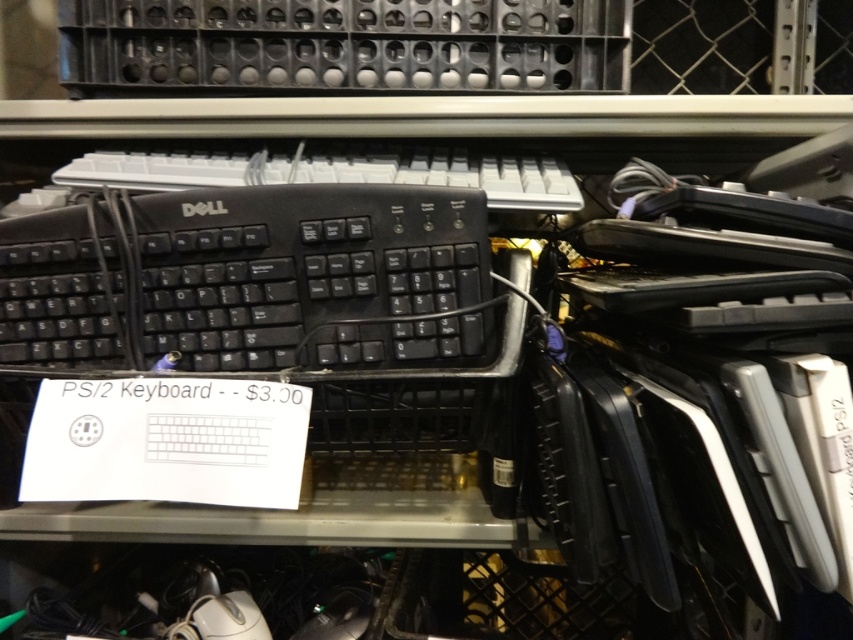
You are a customer at a thrift store holding a 12 inch wide box. You see the white plastic keyboard at upper center that you want to place inside the box. Can the keyboard fit into the box?

The white plastic keyboard at upper center is 25.02 inches long, which is longer than the 12 inch width of the box. Therefore, the keyboard cannot fit into the box.

You are a customer in a thrift store looking at the black matte keyboard at center and the white plastic keyboard at upper center. Which one do you need to lean forward more to examine closely?

You need to lean forward more to examine the white plastic keyboard at upper center because it is further away from you compared to the black matte keyboard at center.